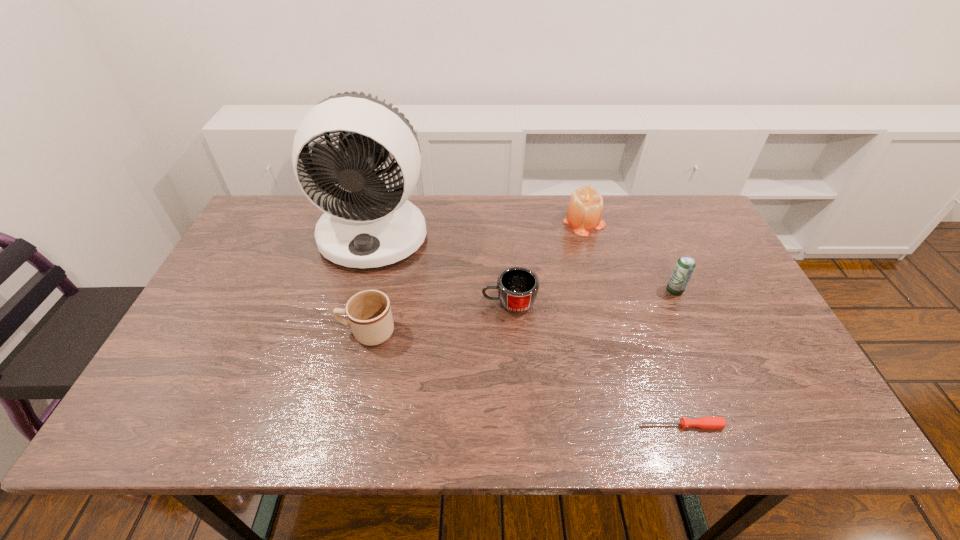
I want to click on free space in the image that satisfies the following two spatial constraints: 1. on the grille of the tallest object; 2. on the side of the left mug with the handle, so click(x=348, y=332).

Locate an element on the screen. free space that satisfies the following two spatial constraints: 1. on the side of the taller mug with the handle; 2. on the right side of the beer can is located at coordinates (377, 291).

You are a GUI agent. You are given a task and a screenshot of the screen. Output one action in this format:
    pyautogui.click(x=<x>, y=<y>)
    Task: Click on the free location that satisfies the following two spatial constraints: 1. on the side of the left mug with the handle; 2. on the grille of the fan
    
    Given the screenshot: What is the action you would take?
    pyautogui.click(x=390, y=235)